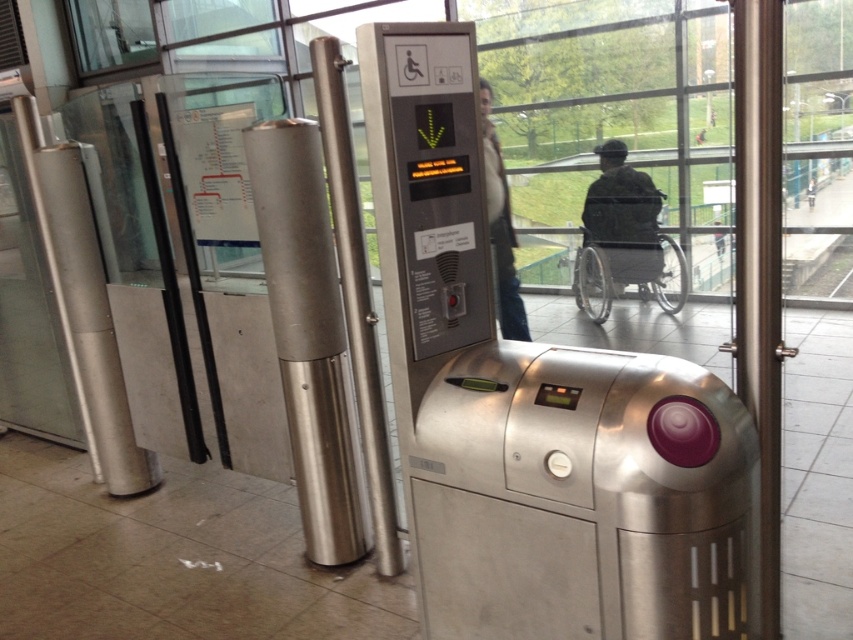
Question: Does silver metallic pillar at left appear on the left side of camouflage fabric wheelchair at center?

Choices:
 (A) yes
 (B) no

Answer: (A)

Question: Considering the real-world distances, which object is closest to the satin silver pole at center?

Choices:
 (A) silver metallic pillar at left
 (B) camouflage fabric wheelchair at center

Answer: (A)

Question: Does camouflage fabric wheelchair at center appear under brown leather jacket at upper center?

Choices:
 (A) yes
 (B) no

Answer: (A)

Question: Considering the real-world distances, which object is closest to the satin silver pole at center?

Choices:
 (A) camouflage fabric wheelchair at center
 (B) silver metallic pillar at left

Answer: (B)

Question: Can you confirm if satin silver pole at center is smaller than brown leather jacket at upper center?

Choices:
 (A) no
 (B) yes

Answer: (B)

Question: Which object appears farthest from the camera in this image?

Choices:
 (A) brown leather jacket at upper center
 (B) camouflage fabric wheelchair at center
 (C) silver metallic pillar at left
 (D) satin silver pole at center

Answer: (B)